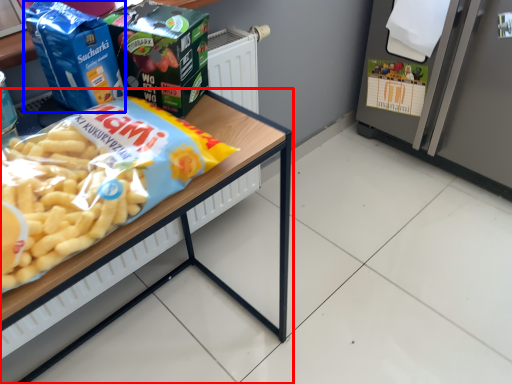
Question: Which of the following is the farthest to the observer, table (highlighted by a red box) or product (highlighted by a blue box)?

Choices:
 (A) table
 (B) product

Answer: (B)